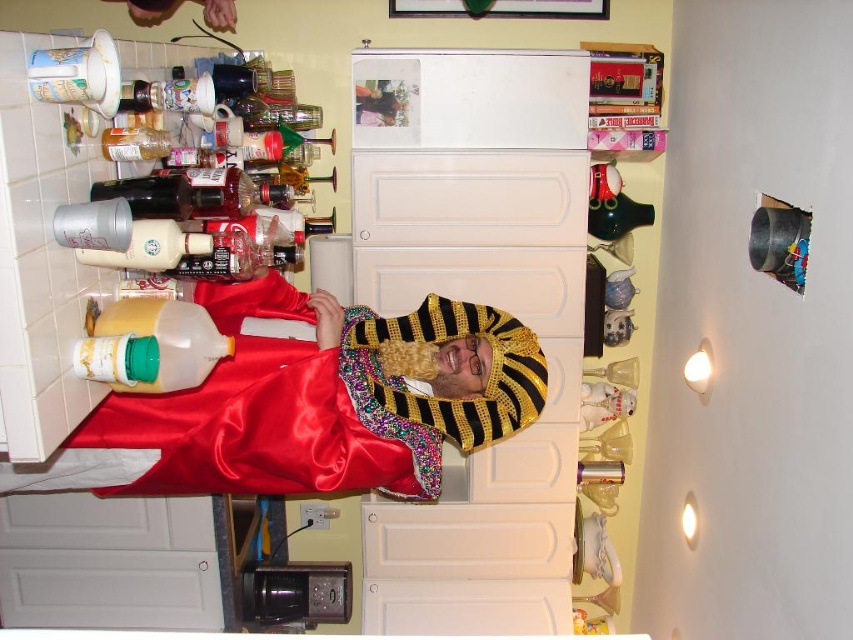
You are a photographer trying to capture the golden headdress at center of the person dressed as an Egyptian pharaoh. You notice a point marked at coordinates (x=308, y=404). Based on the scene description, where is this point located?

The point at coordinates (x=308, y=404) is located on the satin gold headdress at center.

You are planning to place a new decorative item in the kitchen scene. You have the satin gold headdress at center and the yellow translucent jug at left. Which object should you choose if you want to place a larger decorative item on the shelf above the white cabinet?

The satin gold headdress at center has a larger size compared to the yellow translucent jug at left, so you should choose the satin gold headdress at center for placing on the shelf if you want a larger decorative item.

You are an interior designer analyzing the placement of the satin gold headdress at center in the image. What are the coordinates of the headdress?

The coordinates of the satin gold headdress at center are at point (308, 404).